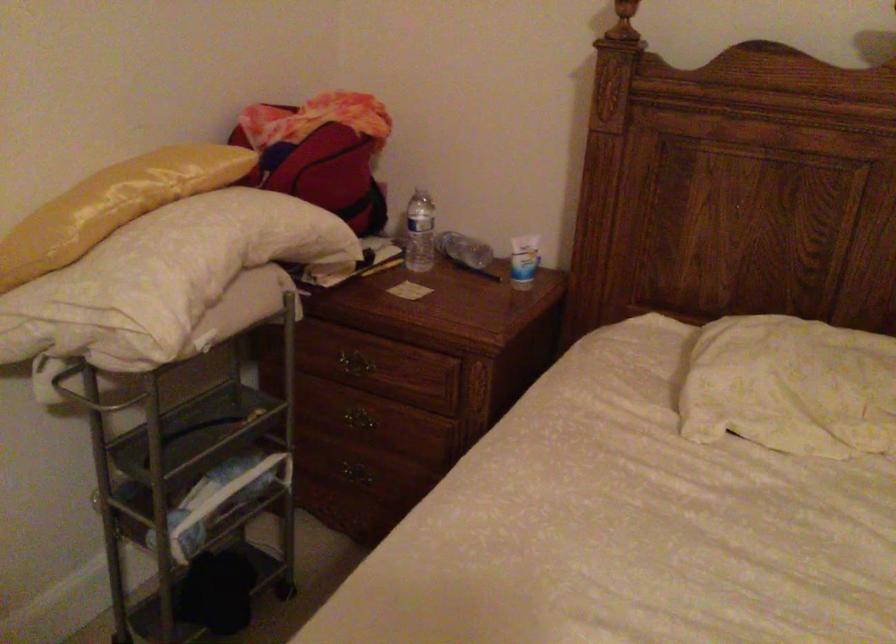
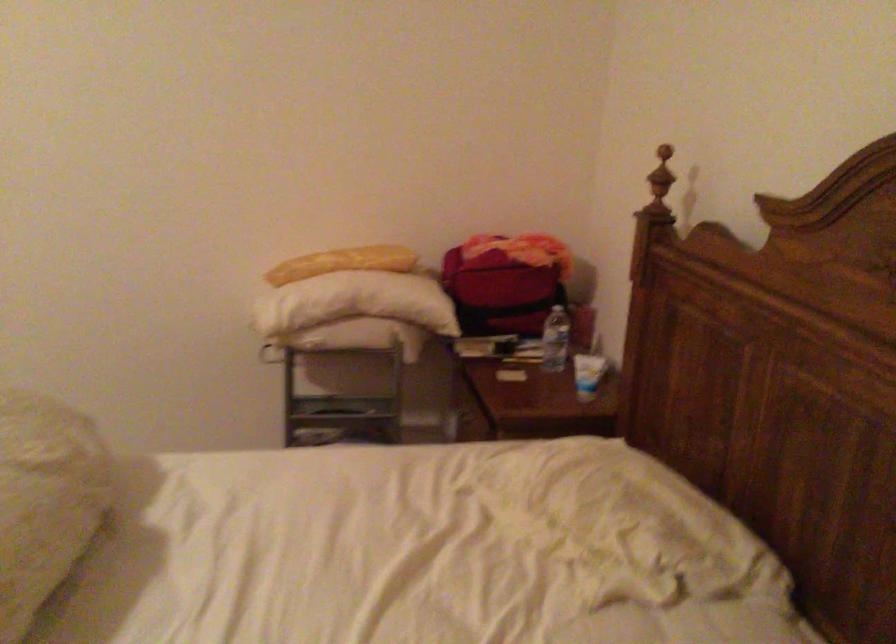
In the second image, find the point that corresponds to pixel 150 196 in the first image.

(342, 263)